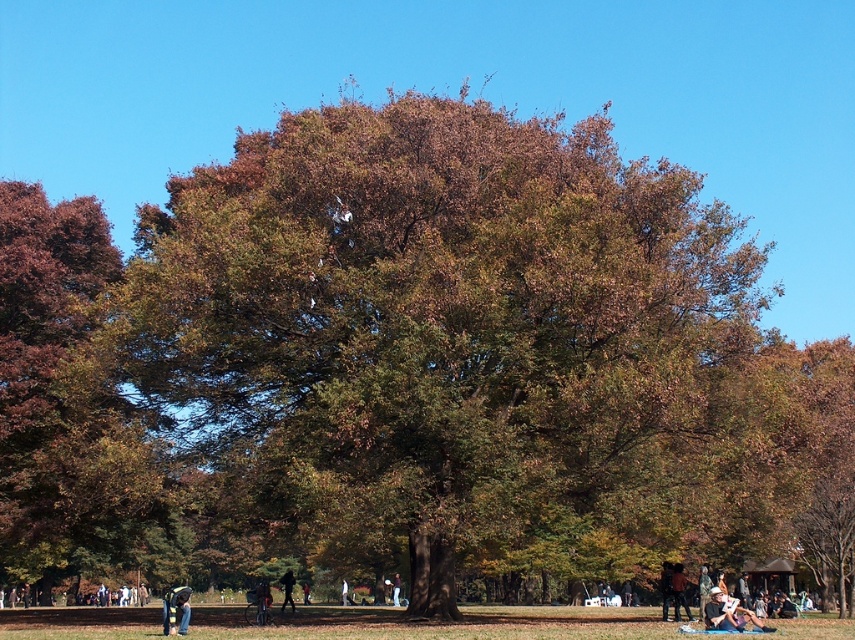
Question: Considering the relative positions of brown leafy tree at center and light brown fabric at center in the image provided, where is brown leafy tree at center located with respect to light brown fabric at center?

Choices:
 (A) right
 (B) left

Answer: (B)

Question: Can you confirm if brown leafy tree at center is positioned above dark brown leather jacket at lower right?

Choices:
 (A) yes
 (B) no

Answer: (A)

Question: Where is brown leafy tree at center located in relation to dark brown leather jacket at lower right in the image?

Choices:
 (A) left
 (B) right

Answer: (A)

Question: Which point appears closest to the camera in this image?

Choices:
 (A) (78, 394)
 (B) (676, 604)
 (C) (736, 608)
 (D) (594, 612)

Answer: (C)

Question: Which object is closer to the camera taking this photo?

Choices:
 (A) dark blue jeans at center
 (B) brown dry grass at lower center

Answer: (B)

Question: Which of the following is the closest to the observer?

Choices:
 (A) dark blue jeans at center
 (B) brown leafy tree at center

Answer: (B)